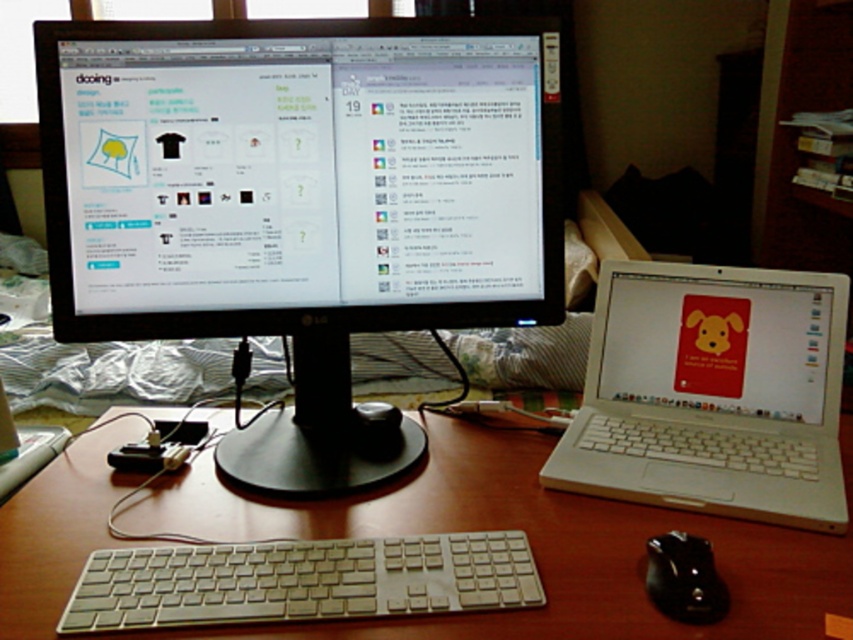
You are organizing your desk and want to place a new item between the wooden desk at center and the black rubber mouse at lower right. Considering their sizes, which object has more space available for placement?

The wooden desk at center has a greater width than the black rubber mouse at lower right, so there is more space available on the wooden desk at center for placing the new item.

You are setting up a new computer setup and want to place a 15cm wide object between the white plastic keyboard at center and the black rubber mouse at lower right. Is there enough space between them?

The white plastic keyboard at center might be wider than black rubber mouse at lower right, but without knowing the exact distance between them, it is impossible to determine if there is enough space for a 15cm wide object.

You are a delivery robot with a 8 inch wide package. You need to place the package between the white plastic keyboard at center and the black rubber mouse at lower right. Is there enough space between them to fit the package?

The distance between the white plastic keyboard at center and the black rubber mouse at lower right is 9.29 inches, which is wider than the 8 inch package. Therefore, the package can be placed between them.